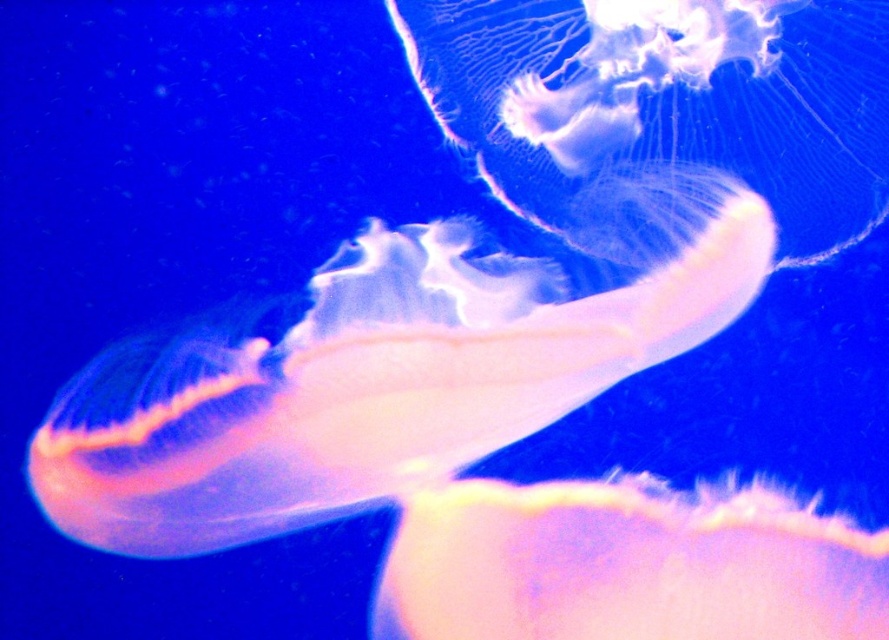
Question: Is translucent white jellyfish at center smaller than translucent pink jellyfish at center?

Choices:
 (A) yes
 (B) no

Answer: (B)

Question: Does translucent white jellyfish at center appear on the left side of translucent white jellyfish at upper center?

Choices:
 (A) no
 (B) yes

Answer: (B)

Question: Estimate the real-world distances between objects in this image. Which object is closer to the translucent pink jellyfish at center?

Choices:
 (A) translucent white jellyfish at center
 (B) translucent white jellyfish at upper center

Answer: (A)

Question: Is translucent white jellyfish at upper center thinner than translucent pink jellyfish at center?

Choices:
 (A) no
 (B) yes

Answer: (A)

Question: Which point appears farthest from the camera in this image?

Choices:
 (A) (546, 68)
 (B) (463, 508)
 (C) (86, 394)

Answer: (A)

Question: Which point is closer to the camera?

Choices:
 (A) translucent white jellyfish at center
 (B) translucent white jellyfish at upper center
 (C) translucent pink jellyfish at center

Answer: (A)